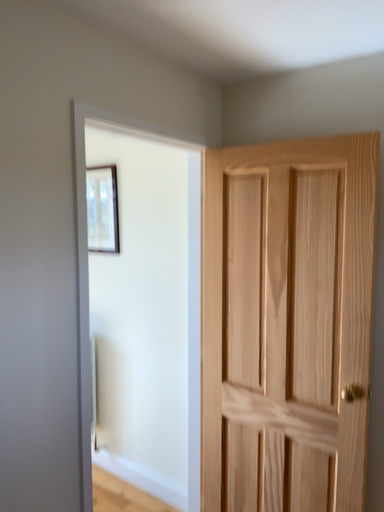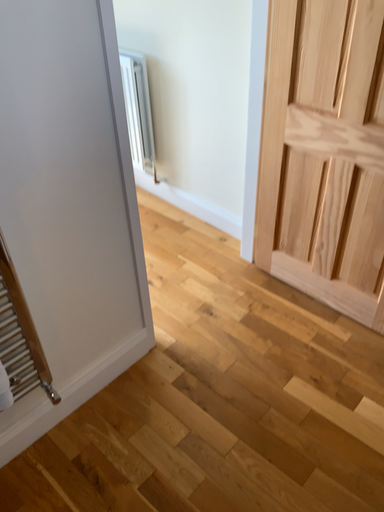
Question: How did the camera likely rotate when shooting the video?

Choices:
 (A) rotated right
 (B) rotated left

Answer: (B)